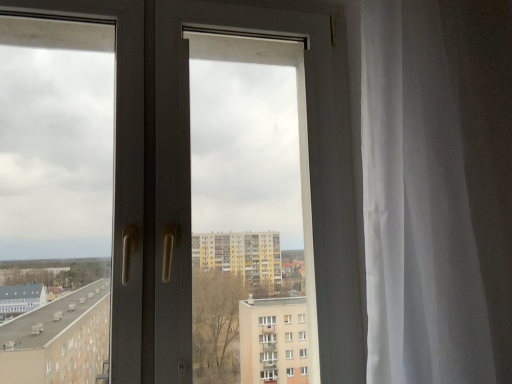
Question: Which is correct: white glossy door at center is inside white sheer curtain at right, or outside of it?

Choices:
 (A) outside
 (B) inside

Answer: (A)

Question: From a real-world perspective, is white glossy door at center positioned above or below white sheer curtain at right?

Choices:
 (A) below
 (B) above

Answer: (B)

Question: Considering the relative positions of white glossy door at center and white sheer curtain at right in the image provided, is white glossy door at center to the left or to the right of white sheer curtain at right?

Choices:
 (A) right
 (B) left

Answer: (B)

Question: In terms of size, does white sheer curtain at right appear bigger or smaller than white glossy door at center?

Choices:
 (A) small
 (B) big

Answer: (B)

Question: From their relative heights in the image, would you say white sheer curtain at right is taller or shorter than white glossy door at center?

Choices:
 (A) short
 (B) tall

Answer: (A)

Question: From the image's perspective, is white sheer curtain at right above or below white glossy door at center?

Choices:
 (A) above
 (B) below

Answer: (A)

Question: Considering the relative positions of white sheer curtain at right and white glossy door at center in the image provided, is white sheer curtain at right to the left or to the right of white glossy door at center?

Choices:
 (A) left
 (B) right

Answer: (B)